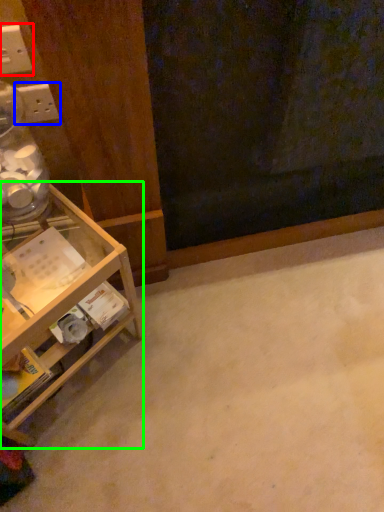
Question: Considering the real-world distances, which object is closest to electric outlet (highlighted by a red box)? electric outlet (highlighted by a blue box) or shelf (highlighted by a green box).

Choices:
 (A) electric outlet
 (B) shelf

Answer: (A)